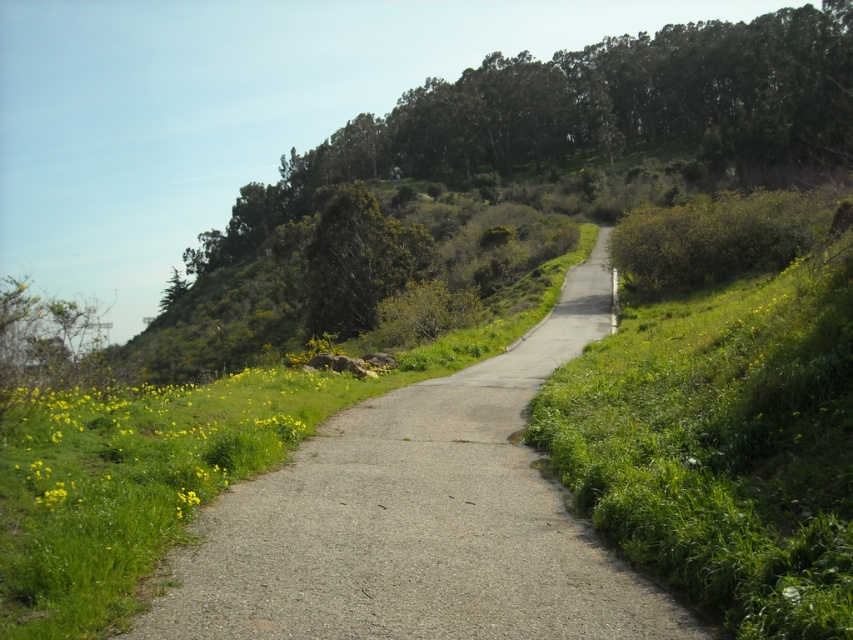
Based on the photo, does yellow grass at lower left appear under green textured tree at upper center?

Indeed, yellow grass at lower left is positioned under green textured tree at upper center.

Where is `yellow grass at lower left`? yellow grass at lower left is located at coordinates (155, 440).

Is gray asphalt path at center closer to the viewer compared to green leafy tree at upper center?

That is True.

Is gray asphalt path at center shorter than green leafy tree at upper center?

Correct, gray asphalt path at center is not as tall as green leafy tree at upper center.

The image size is (853, 640). What do you see at coordinates (421, 518) in the screenshot? I see `gray asphalt path at center` at bounding box center [421, 518].

Locate an element on the screen. The image size is (853, 640). gray asphalt path at center is located at coordinates (421, 518).

Can you confirm if gray asphalt path at center is smaller than yellow grass at lower left?

No, gray asphalt path at center is not smaller than yellow grass at lower left.

From the picture: Who is positioned more to the right, gray asphalt path at center or yellow grass at lower left?

From the viewer's perspective, gray asphalt path at center appears more on the right side.

Where is `gray asphalt path at center`? gray asphalt path at center is located at coordinates (421, 518).